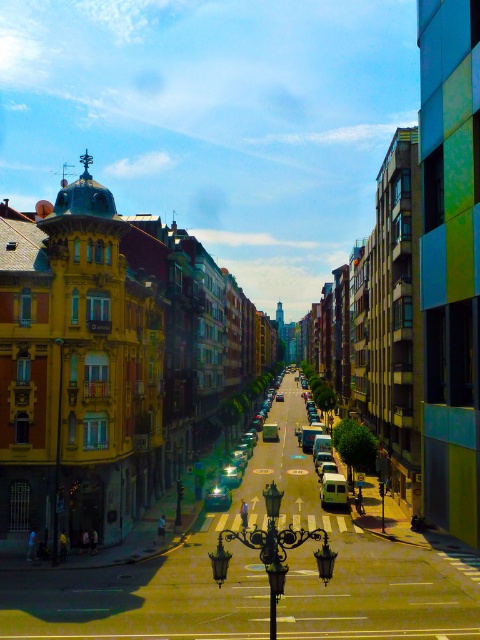
Question: Is shiny silver car at center to the left of white matte van at center from the viewer's perspective?

Choices:
 (A) yes
 (B) no

Answer: (A)

Question: Does shiny silver car at center lie in front of white matte van at center?

Choices:
 (A) yes
 (B) no

Answer: (B)

Question: Is shiny silver car at center below white matte van at center?

Choices:
 (A) no
 (B) yes

Answer: (B)

Question: Which object appears closest to the camera in this image?

Choices:
 (A) white matte van at center
 (B) shiny silver car at center

Answer: (A)

Question: Which point is farther to the camera?

Choices:
 (A) coord(214,502)
 (B) coord(346,481)

Answer: (B)